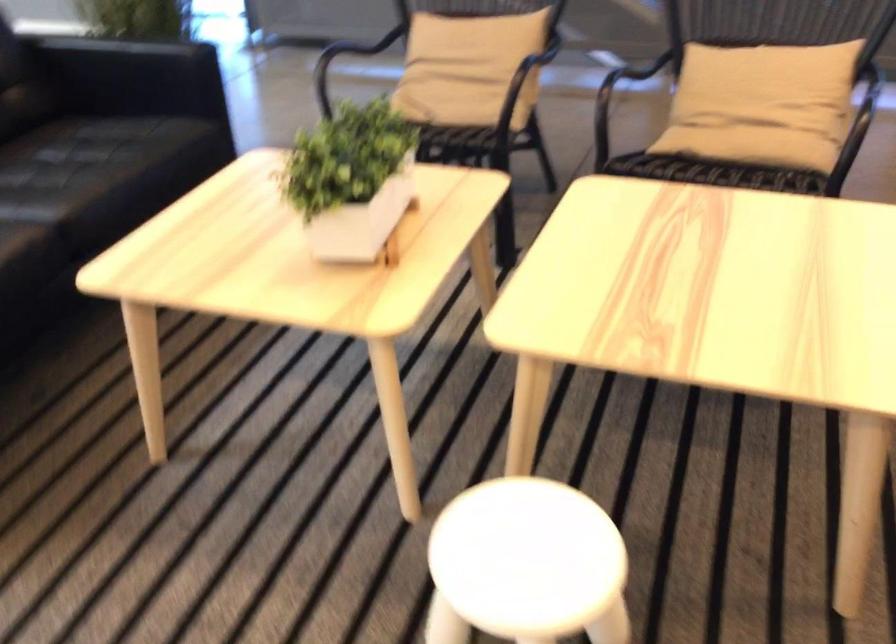
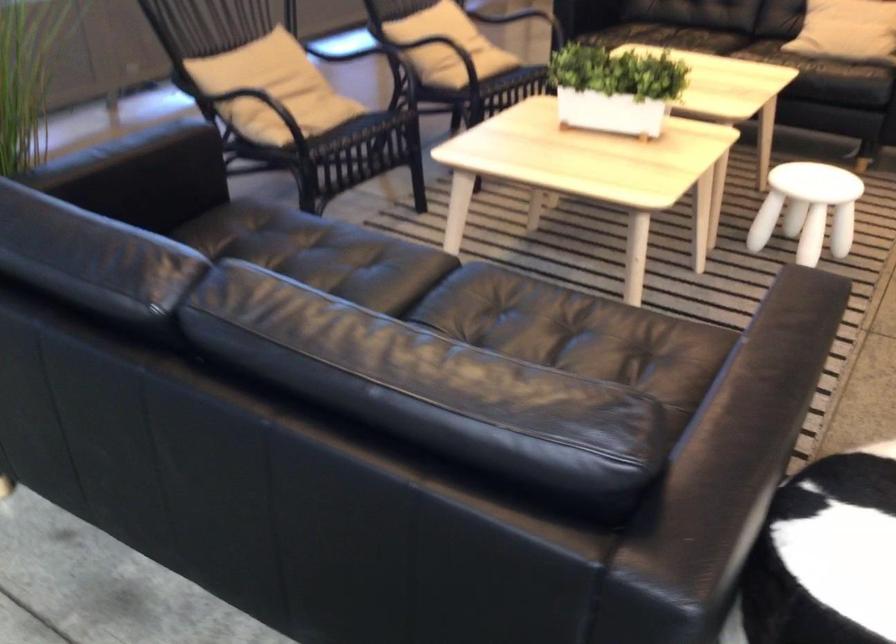
In the second image, find the point that corresponds to pixel 716 88 in the first image.

(433, 43)